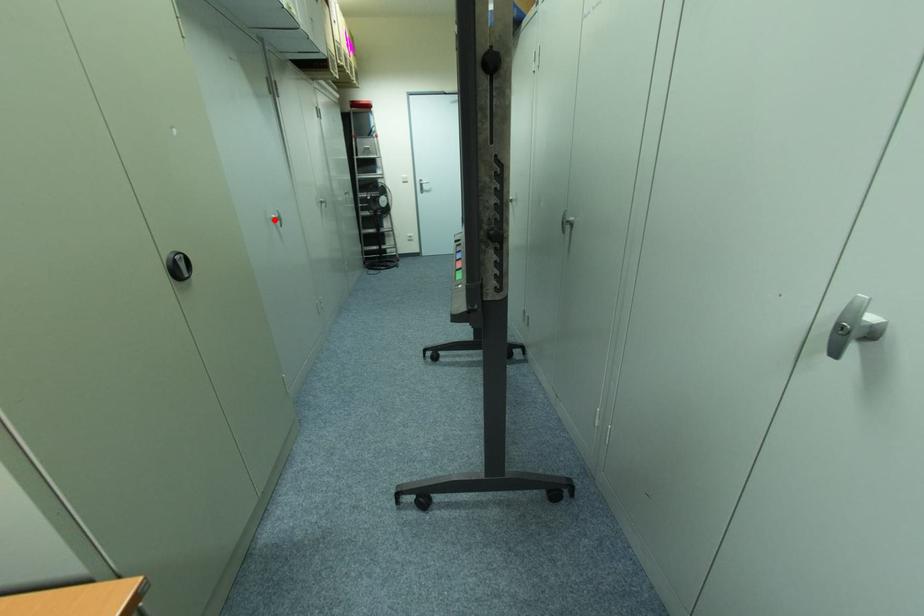
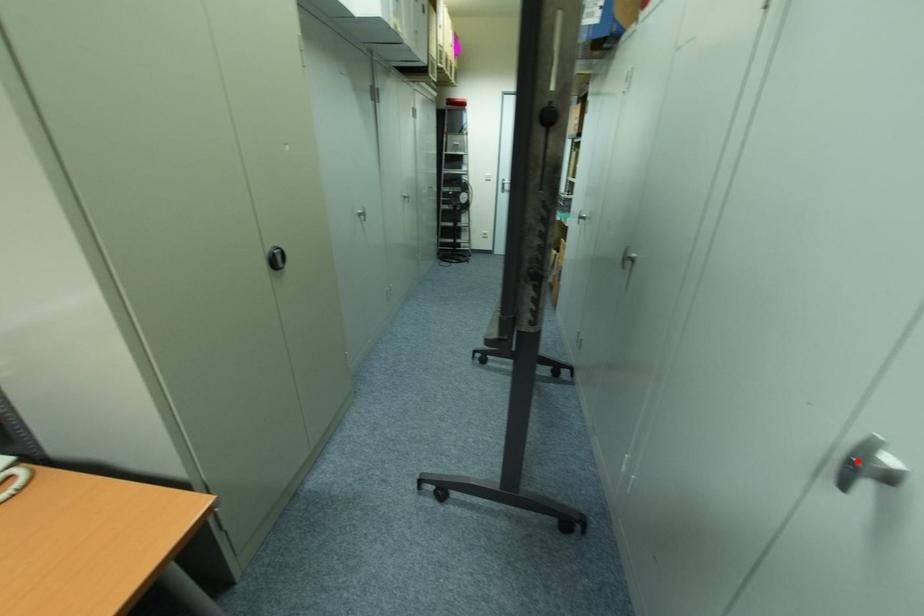
I am providing you with two images of the same scene from different viewpoints. A red point is marked on the first image and another point is marked on the second image. Does the point marked in image1 correspond to the same location as the one in image2?

No